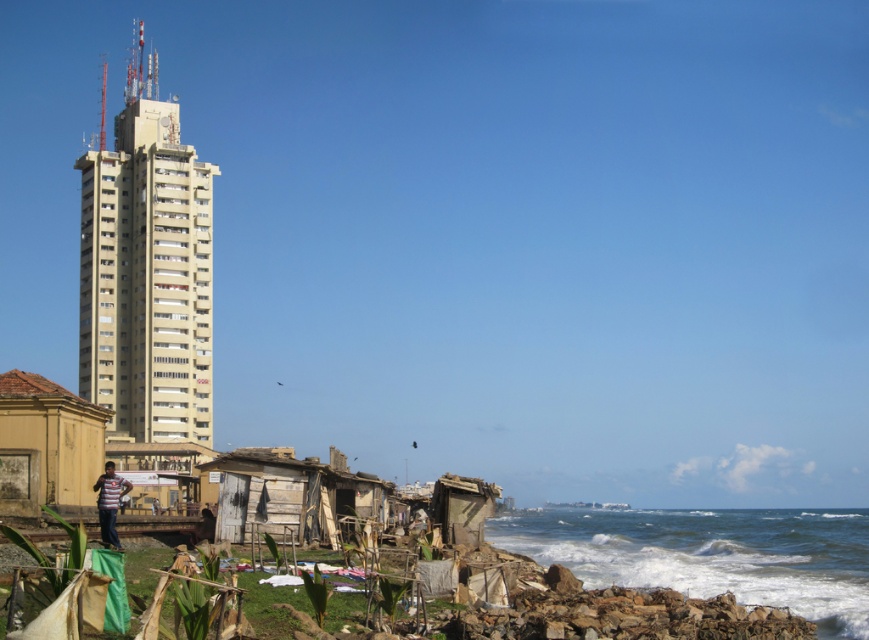
Question: Which of the following is the closest to the observer?

Choices:
 (A) wooden shack at lower left
 (B) weathered wood hut at lower center
 (C) yellow textured hut at lower left

Answer: (C)

Question: Is yellow textured hut at lower left behind rusty corrugated metal hut at lower center?

Choices:
 (A) no
 (B) yes

Answer: (A)

Question: Does beige concrete tower at upper left have a greater width compared to wooden shack at lower left?

Choices:
 (A) no
 (B) yes

Answer: (B)

Question: Can you confirm if yellow textured hut at lower left is positioned above striped fabric shirt at lower left?

Choices:
 (A) yes
 (B) no

Answer: (A)

Question: Which point appears closest to the camera in this image?

Choices:
 (A) [438, 500]
 (B) [171, 106]
 (C) [125, 493]

Answer: (C)

Question: Which object is closer to the camera taking this photo?

Choices:
 (A) rusty corrugated metal hut at lower center
 (B) yellow textured hut at lower left

Answer: (B)